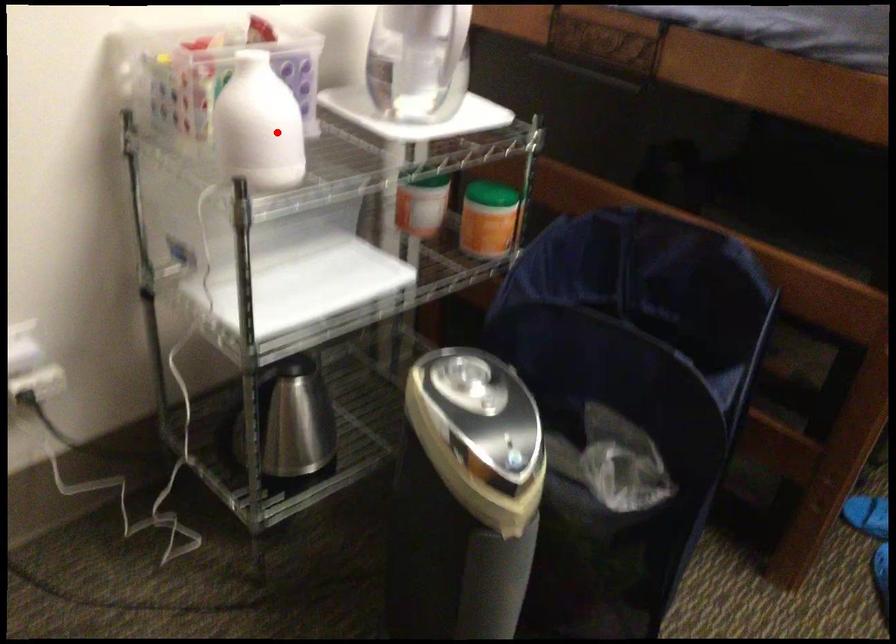
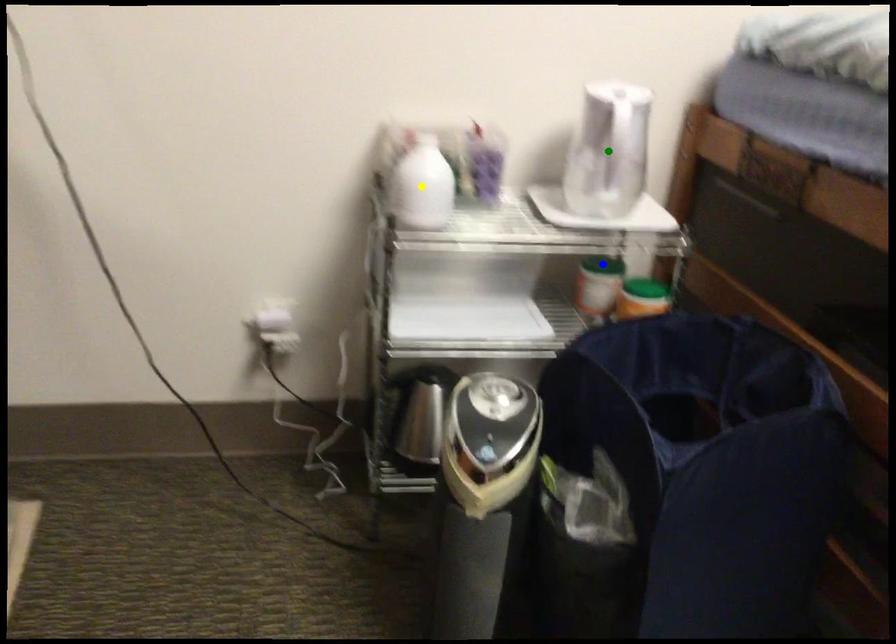
Question: I am providing you with two images of the same scene from different viewpoints. A red point is marked on the first image. You are given multiple points on the second image. In image 2, which mark is for the same physical point as the one in image 1?

Choices:
 (A) blue point
 (B) green point
 (C) yellow point

Answer: (C)